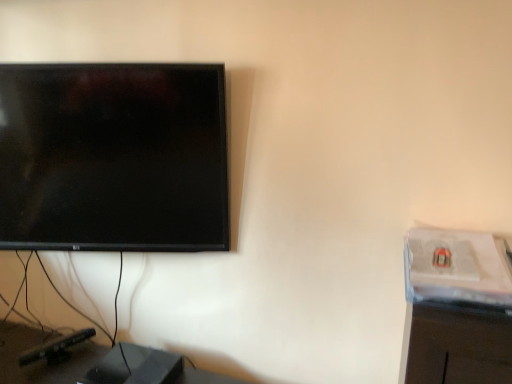
Question: Is black plastic speaker at lower left shorter than clear plastic computer desk at right?

Choices:
 (A) no
 (B) yes

Answer: (A)

Question: Does black plastic speaker at lower left have a lesser width compared to clear plastic computer desk at right?

Choices:
 (A) yes
 (B) no

Answer: (B)

Question: From a real-world perspective, is black plastic speaker at lower left on top of clear plastic computer desk at right?

Choices:
 (A) yes
 (B) no

Answer: (B)

Question: Is black plastic speaker at lower left positioned with its back to clear plastic computer desk at right?

Choices:
 (A) yes
 (B) no

Answer: (B)

Question: Can we say black plastic speaker at lower left lies outside clear plastic computer desk at right?

Choices:
 (A) no
 (B) yes

Answer: (B)

Question: Can you confirm if black plastic speaker at lower left is taller than clear plastic computer desk at right?

Choices:
 (A) yes
 (B) no

Answer: (A)

Question: From the image's perspective, is clear plastic computer desk at right under black plastic speaker at lower left?

Choices:
 (A) yes
 (B) no

Answer: (B)

Question: Can you confirm if clear plastic computer desk at right is wider than black plastic speaker at lower left?

Choices:
 (A) yes
 (B) no

Answer: (B)

Question: Is clear plastic computer desk at right positioned before black plastic speaker at lower left?

Choices:
 (A) no
 (B) yes

Answer: (B)

Question: Considering the relative positions of clear plastic computer desk at right and black plastic speaker at lower left in the image provided, is clear plastic computer desk at right to the right of black plastic speaker at lower left from the viewer's perspective?

Choices:
 (A) no
 (B) yes

Answer: (B)

Question: Is clear plastic computer desk at right beside black plastic speaker at lower left?

Choices:
 (A) no
 (B) yes

Answer: (A)

Question: From the image's perspective, is clear plastic computer desk at right over black plastic speaker at lower left?

Choices:
 (A) no
 (B) yes

Answer: (B)

Question: Based on their sizes in the image, would you say clear plastic computer desk at right is bigger or smaller than black plastic speaker at lower left?

Choices:
 (A) big
 (B) small

Answer: (B)